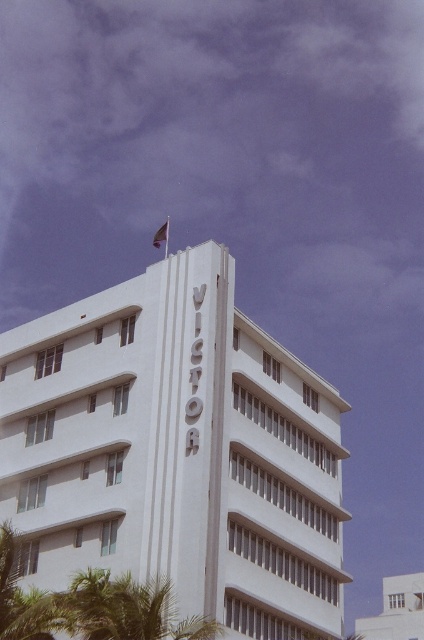
Between white smooth building at center and silky red flag at upper center, which one appears on the left side from the viewer's perspective?

From the viewer's perspective, silky red flag at upper center appears more on the left side.

Who is shorter, white smooth building at center or silky red flag at upper center?

silky red flag at upper center

This screenshot has width=424, height=640. Describe the element at coordinates (176, 451) in the screenshot. I see `white smooth building at center` at that location.

The width and height of the screenshot is (424, 640). Find the location of `white smooth building at center`. white smooth building at center is located at coordinates (176, 451).